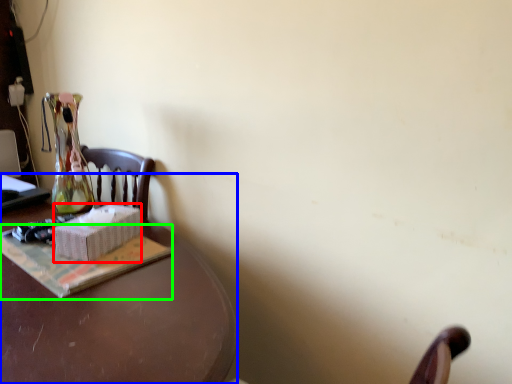
Question: Which is farther away from box (highlighted by a red box)? desk (highlighted by a blue box) or paperback book (highlighted by a green box)?

Choices:
 (A) desk
 (B) paperback book

Answer: (A)